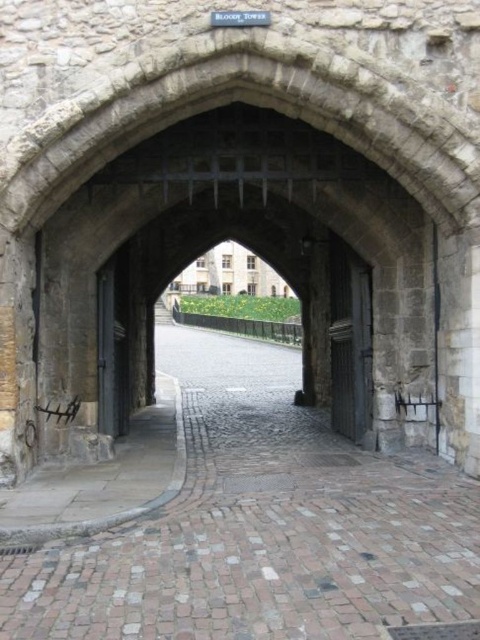
You are standing at the entrance of the Bloody Tower archway. You notice two points marked on the archway. The first point is at coordinate (355, 515) and the second is at coordinate (124, 269). From your perspective, which point appears closer to you?

The point at coordinate (355, 515) appears closer because it is in front of the point at coordinate 0.260, 0.422 according to their spatial arrangement.

You are a tour guide leading visitors through the castle grounds. You need to direct them to the entrance of the Bloody Tower. Which object is closer to the archway, the cobblestone path at center or the dark gray metal door at left?

The cobblestone path at center is closer to the archway because it is shorter than the dark gray metal door at left.